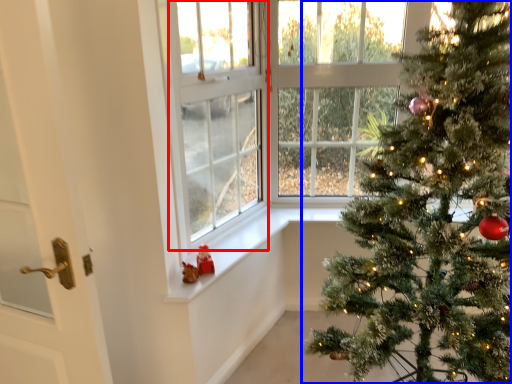
Question: Which object appears closest to the camera in this image, window screen (highlighted by a red box) or christmas tree (highlighted by a blue box)?

Choices:
 (A) window screen
 (B) christmas tree

Answer: (B)